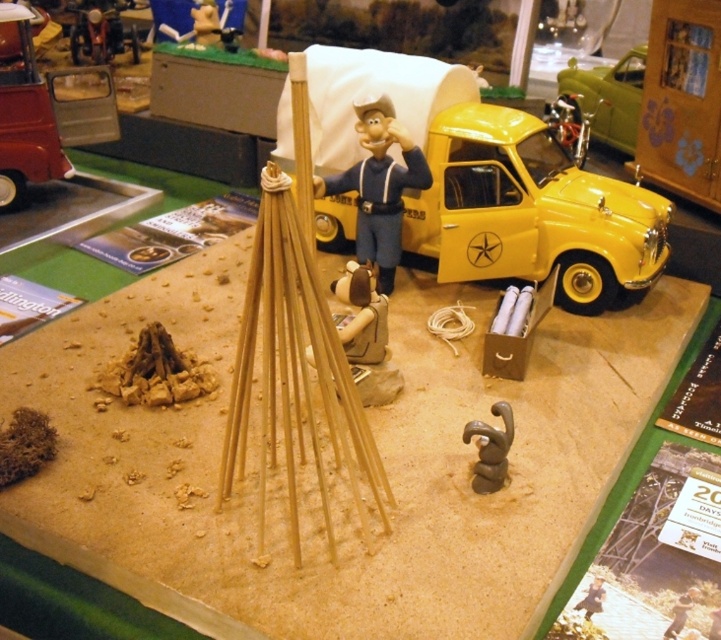
Between yellow matte toy car at upper right and brown clay figurine at lower right, which one is positioned higher?

yellow matte toy car at upper right

Does yellow matte toy car at upper right have a smaller size compared to brown clay figurine at lower right?

No.

Between point (455, 154) and point (497, 470), which one is positioned in front?

Point (497, 470) is in front.

Image resolution: width=721 pixels, height=640 pixels. In order to click on yellow matte toy car at upper right in this screenshot , I will do `click(531, 212)`.

Does yellow matte toy car at upper right appear under green metallic car at upper right?

Yes, yellow matte toy car at upper right is below green metallic car at upper right.

Does point (477, 204) come in front of point (634, 49)?

Yes.

Is point (410, 193) more distant than point (637, 106)?

No, (410, 193) is closer to viewer.

I want to click on yellow matte toy car at upper right, so click(531, 212).

Between point (610, 108) and point (105, 17), which one is positioned behind?

The point (105, 17) is behind.

Is point (605, 115) closer to camera compared to point (115, 28)?

Yes, it is.

Where is `green metallic car at upper right`? green metallic car at upper right is located at coordinates (609, 97).